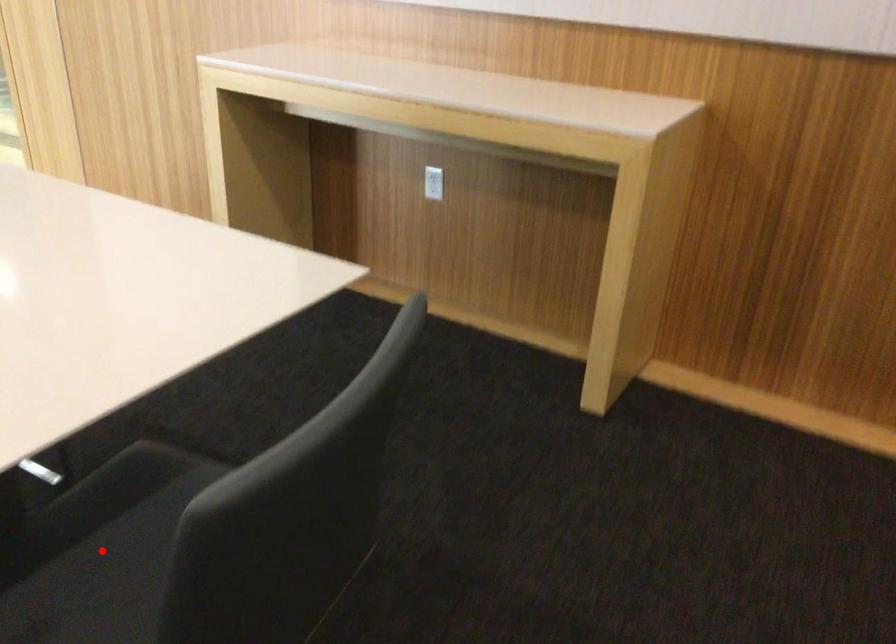
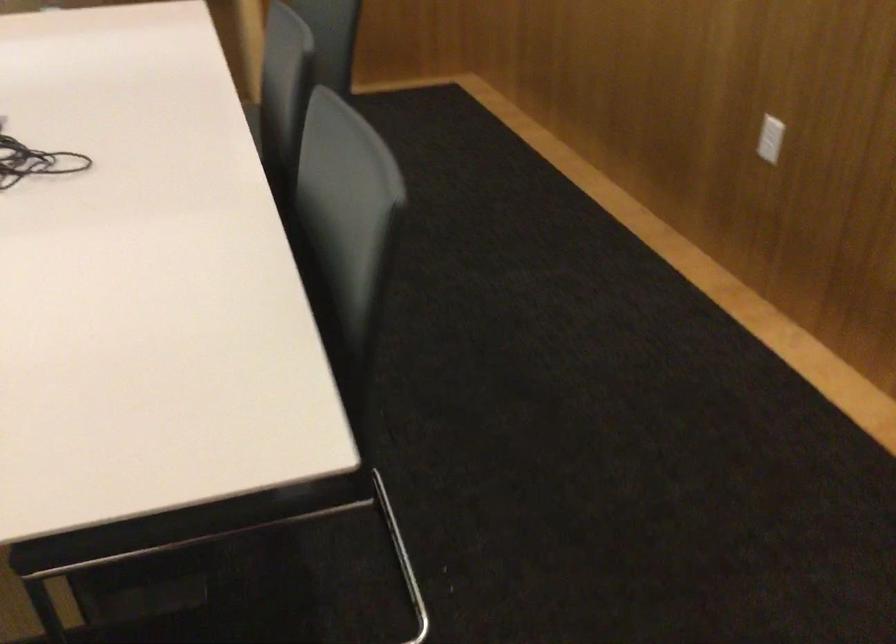
Question: I am providing you with two images of the same scene from different viewpoints. A red point is marked on the first image. At the location where the point appears in image 1, is it still visible in image 2?

Choices:
 (A) Yes
 (B) No

Answer: (B)